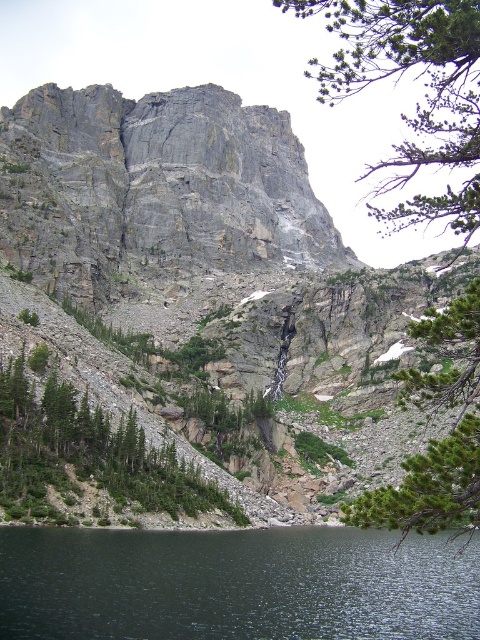
Question: Which object appears closest to the camera in this image?

Choices:
 (A) green leafy tree at upper center
 (B) gray rock mountain at upper center
 (C) green rough rock at center

Answer: (B)

Question: Does green leafy tree at center have a lesser width compared to green rough rock at center?

Choices:
 (A) yes
 (B) no

Answer: (B)

Question: Which object appears farthest from the camera in this image?

Choices:
 (A) gray rock mountain at upper center
 (B) green leafy tree at upper center

Answer: (B)

Question: Which point is closer to the camera?

Choices:
 (A) (227, 115)
 (B) (474, 580)
 (C) (384, 192)

Answer: (B)

Question: Is gray rock mountain at upper center smaller than green leafy tree at center?

Choices:
 (A) no
 (B) yes

Answer: (B)

Question: Can you confirm if dark reflective water at lower center is positioned above green leafy tree at center?

Choices:
 (A) no
 (B) yes

Answer: (A)